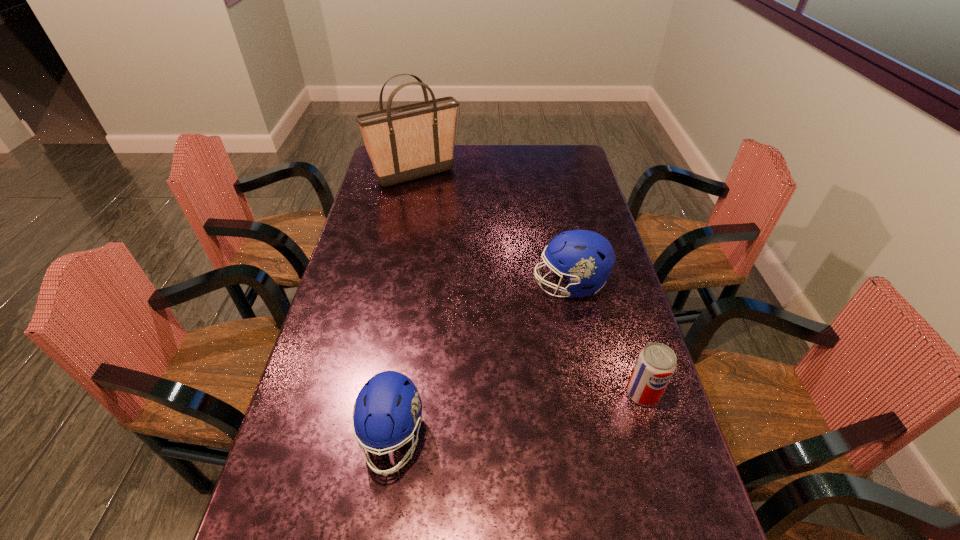
Where is `vacant space that is in between the tallest object and the left football helmet`? vacant space that is in between the tallest object and the left football helmet is located at coordinates (404, 307).

The image size is (960, 540). What are the coordinates of `free space between the left football helmet and the soda` in the screenshot? It's located at (517, 415).

This screenshot has height=540, width=960. I want to click on free space between the soda and the second farthest object, so click(607, 339).

Identify the location of vacant region between the farther football helmet and the nearer football helmet. The width and height of the screenshot is (960, 540). (481, 361).

Where is `vacant area between the right football helmet and the shopping bag`? Image resolution: width=960 pixels, height=540 pixels. vacant area between the right football helmet and the shopping bag is located at coordinates [492, 230].

Locate an element on the screen. This screenshot has width=960, height=540. vacant point located between the soda and the shopping bag is located at coordinates (529, 284).

Where is `free point between the left football helmet and the right football helmet`? This screenshot has width=960, height=540. free point between the left football helmet and the right football helmet is located at coordinates (481, 361).

Where is `unoccupied position between the soda and the third nearest object`? This screenshot has height=540, width=960. unoccupied position between the soda and the third nearest object is located at coordinates (607, 339).

The width and height of the screenshot is (960, 540). I want to click on free space between the third nearest object and the soda, so click(x=607, y=339).

The width and height of the screenshot is (960, 540). I want to click on free space between the shopping bag and the soda, so click(x=529, y=284).